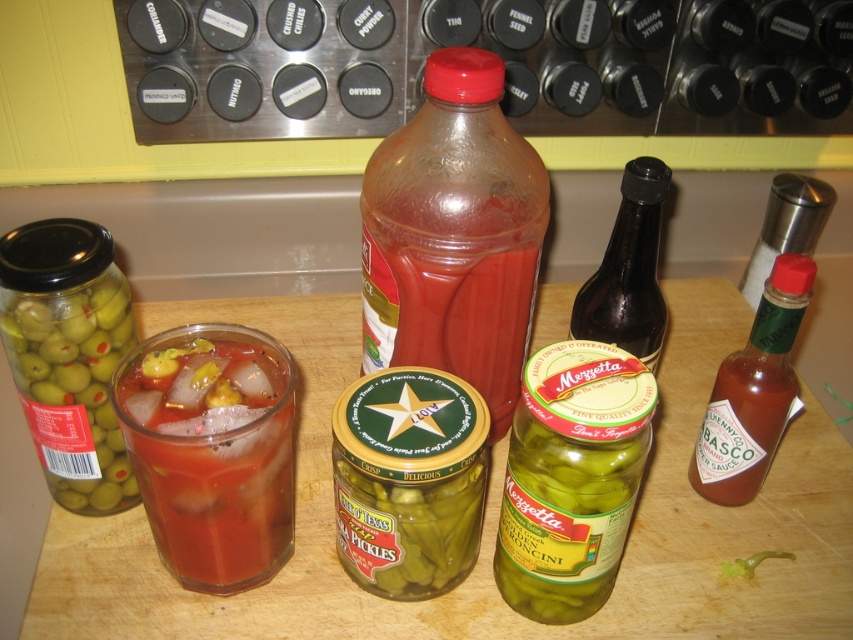
How distant is translucent glass drink at center from red glass tabasco sauce at right?

translucent glass drink at center is 32.70 centimeters from red glass tabasco sauce at right.

Between translucent glass drink at center and red glass tabasco sauce at right, which one appears on the right side from the viewer's perspective?

red glass tabasco sauce at right

What do you see at coordinates (212, 451) in the screenshot?
I see `translucent glass drink at center` at bounding box center [212, 451].

Find the location of a particular element. Image resolution: width=853 pixels, height=640 pixels. translucent glass drink at center is located at coordinates (212, 451).

Does translucent plastic bottle at center appear on the right side of red glass tabasco sauce at right?

No, translucent plastic bottle at center is not to the right of red glass tabasco sauce at right.

Is translucent plastic bottle at center above red glass tabasco sauce at right?

Indeed, translucent plastic bottle at center is positioned over red glass tabasco sauce at right.

Between point (448, 342) and point (780, 368), which one is positioned behind?

Point (448, 342)

I want to click on translucent plastic bottle at center, so click(x=454, y=234).

Can you confirm if translucent glass drink at center is positioned above dark brown glass bottle at center-right?

No, translucent glass drink at center is not above dark brown glass bottle at center-right.

This screenshot has height=640, width=853. Find the location of `translucent glass drink at center`. translucent glass drink at center is located at coordinates (212, 451).

Which is in front, point (132, 461) or point (628, 266)?

Point (132, 461) is in front.

The image size is (853, 640). Find the location of `translucent glass drink at center`. translucent glass drink at center is located at coordinates (212, 451).